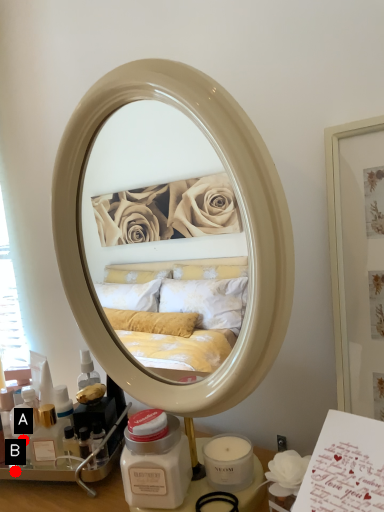
Question: Two points are circled on the image, labeled by A and B beside each circle. Which point appears farthest from the camera in this image?

Choices:
 (A) A is further
 (B) B is further

Answer: (A)